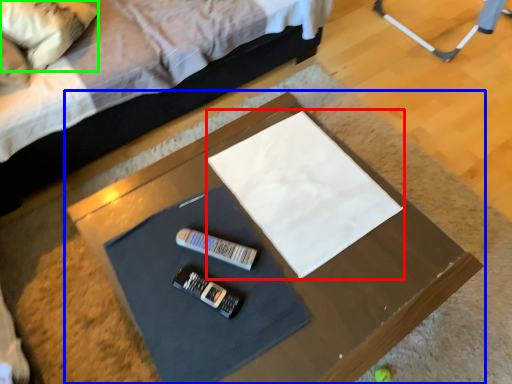
Question: Based on their relative distances, which object is farther from linen (highlighted by a red box)? Choose from table (highlighted by a blue box) and pillow (highlighted by a green box).

Choices:
 (A) table
 (B) pillow

Answer: (B)